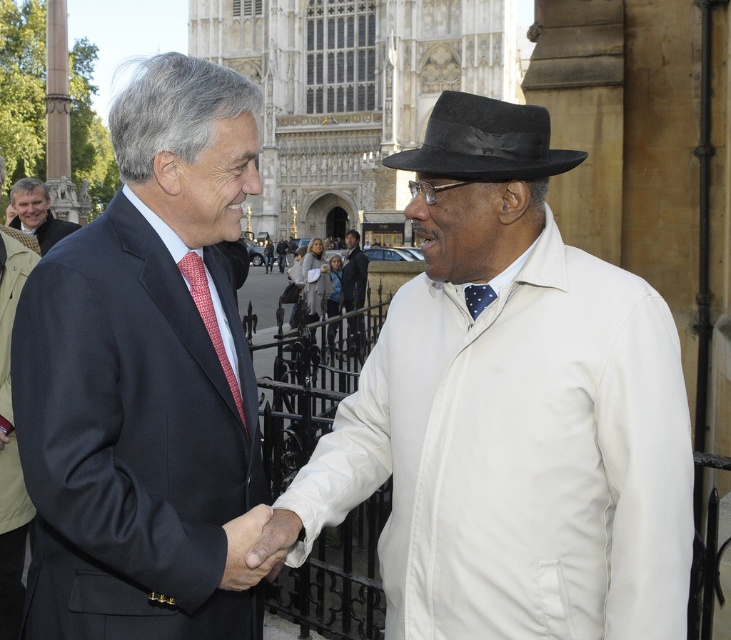
Question: Considering the relative positions of matte black suit at upper left and white cotton shirt at center in the image provided, where is matte black suit at upper left located with respect to white cotton shirt at center?

Choices:
 (A) above
 (B) below

Answer: (A)

Question: Can you confirm if matte black suit at center is positioned to the right of matte black suit at upper left?

Choices:
 (A) yes
 (B) no

Answer: (A)

Question: Can you confirm if white matte jacket at center is wider than matte black suit at center?

Choices:
 (A) no
 (B) yes

Answer: (B)

Question: Which is nearer to the red dotted tie at left?

Choices:
 (A) white cotton shirt at center
 (B) blue silk tie at center
 (C) matte black suit at center

Answer: (C)

Question: Which point appears farthest from the camera in this image?

Choices:
 (A) (39, 241)
 (B) (230, 376)
 (C) (352, 317)
 (D) (482, 298)

Answer: (A)

Question: Among these points, which one is nearest to the camera?

Choices:
 (A) pos(202,268)
 (B) pos(330,476)
 (C) pos(515,134)
 (D) pos(466,292)

Answer: (C)